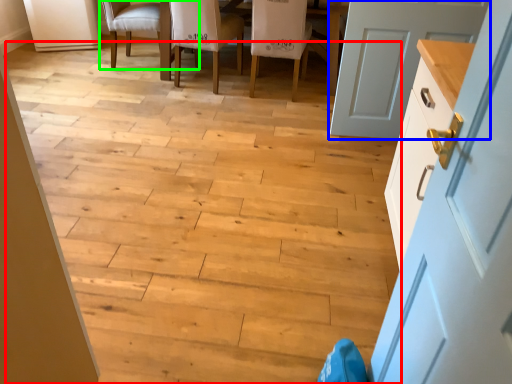
Question: Estimate the real-world distances between objects in this image. Which object is farther from stair (highlighted by a red box), door (highlighted by a blue box) or chair (highlighted by a green box)?

Choices:
 (A) door
 (B) chair

Answer: (B)